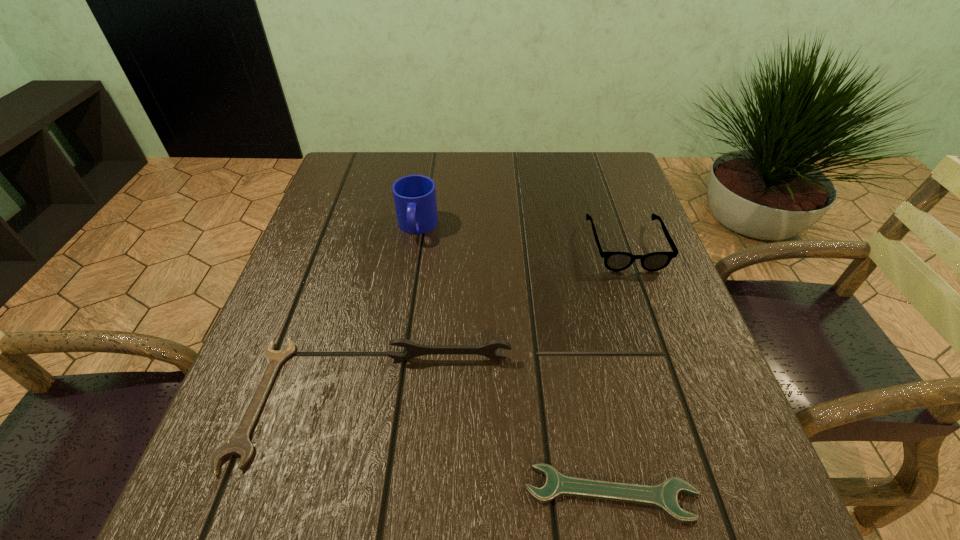
Image resolution: width=960 pixels, height=540 pixels. What are the coordinates of `vacant region at the near left corner of the desktop` in the screenshot? It's located at (187, 522).

The width and height of the screenshot is (960, 540). I want to click on free space at the far right corner, so click(577, 162).

At what (x,y) coordinates should I click in order to perform the action: click on free space between the spectacles and the leftmost wrench. Please return your answer as a coordinate pair (x, y). This screenshot has width=960, height=540. Looking at the image, I should click on (442, 323).

Find the location of a particular element. vacant space that is in between the tallest wrench and the spectacles is located at coordinates (538, 302).

Locate an element on the screen. This screenshot has height=540, width=960. free space between the leftmost wrench and the spectacles is located at coordinates (442, 323).

What are the coordinates of `unoccupied position between the spectacles and the leftmost object` in the screenshot? It's located at (442, 323).

What are the coordinates of `vacant area between the spectacles and the second wrench from right to left` in the screenshot? It's located at (538, 302).

This screenshot has width=960, height=540. I want to click on unoccupied area between the rightmost wrench and the tallest object, so click(514, 360).

Where is `free spot between the spectacles and the second wrench from right to left`? This screenshot has height=540, width=960. free spot between the spectacles and the second wrench from right to left is located at coordinates (538, 302).

This screenshot has height=540, width=960. I want to click on free space between the leftmost wrench and the tallest object, so click(x=338, y=314).